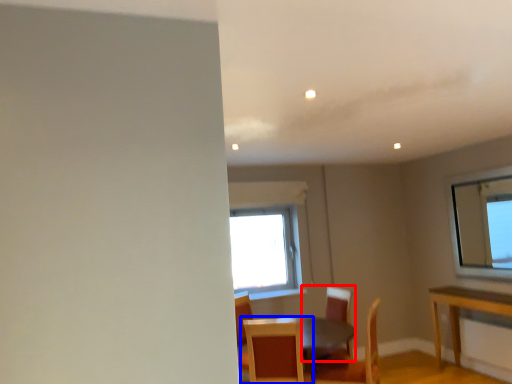
Question: Which point is further to the camera, chair (highlighted by a red box) or chair (highlighted by a blue box)?

Choices:
 (A) chair
 (B) chair

Answer: (A)